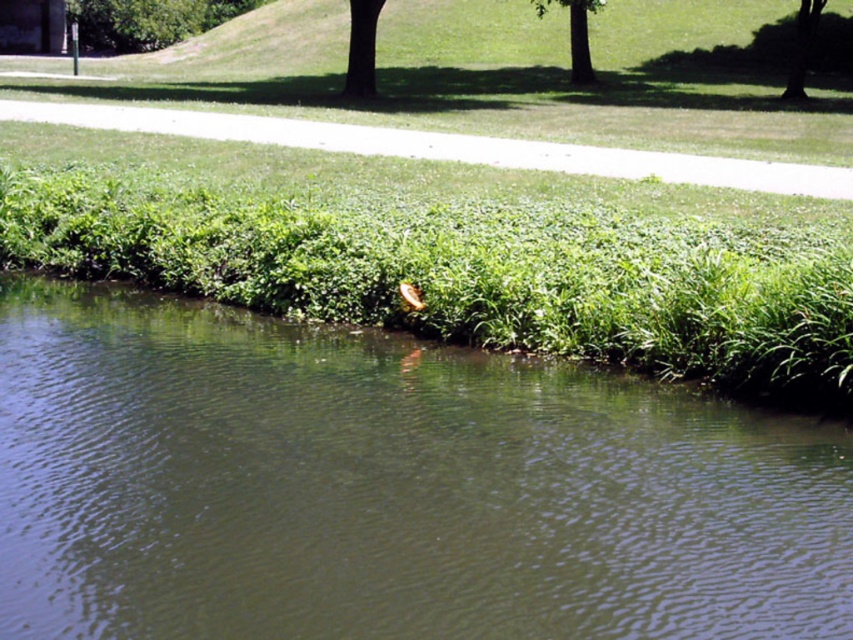
Who is lower down, green leafy tree at upper left or green leafy tree at upper right?

Positioned lower is green leafy tree at upper right.

Who is more distant from viewer, (196,4) or (785,84)?

Point (196,4)

Locate an element on the screen. green leafy tree at upper left is located at coordinates (148, 20).

Locate an element on the screen. This screenshot has width=853, height=640. green grassy river at center is located at coordinates (387, 486).

Which is below, green grassy river at center or green leafy tree at upper right?

green grassy river at center

Does point (28, 332) come farther from viewer compared to point (804, 20)?

No, (28, 332) is closer to viewer.

You are a GUI agent. You are given a task and a screenshot of the screen. Output one action in this format:
    pyautogui.click(x=<x>, y=<y>)
    Task: Click on the green grassy river at center
    Image resolution: width=853 pixels, height=640 pixels.
    Given the screenshot: What is the action you would take?
    pyautogui.click(x=387, y=486)

Is dark brown textured tree at upper center below green leafy tree at upper right?

Yes, dark brown textured tree at upper center is below green leafy tree at upper right.

The image size is (853, 640). I want to click on dark brown textured tree at upper center, so click(x=361, y=49).

Which is behind, point (369, 4) or point (824, 3)?

The point (824, 3) is more distant.

Where is `dark brown textured tree at upper center`? Image resolution: width=853 pixels, height=640 pixels. dark brown textured tree at upper center is located at coordinates (361, 49).